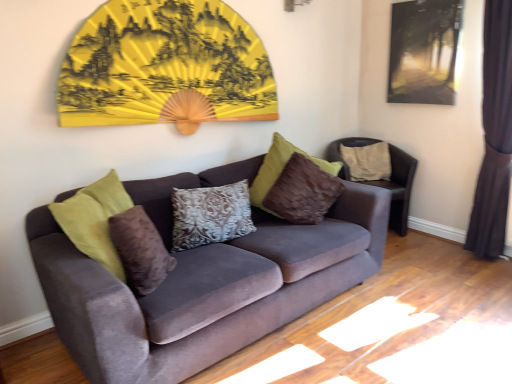
The height and width of the screenshot is (384, 512). Identify the location of beige fabric pillow at right, acting as the third pillow starting from the left. (367, 161).

Identify the location of yellow paper fan at upper center. (165, 67).

Describe the element at coordinates (165, 67) in the screenshot. I see `yellow paper fan at upper center` at that location.

Where is `velvet brown chair at right`? velvet brown chair at right is located at coordinates (398, 188).

Consider the image. Measure the distance between dark brown velvet curtain at right and camera.

The depth of dark brown velvet curtain at right is 8.89 feet.

Image resolution: width=512 pixels, height=384 pixels. I want to click on matte black picture frame at upper right, so click(x=424, y=51).

Identify the location of brown velvet pillow at center, the first pillow when ordered from left to right. This screenshot has height=384, width=512. [140, 250].

What are the coordinates of `beige fabric pillow at right, which is the third pillow from front to back` in the screenshot? It's located at (367, 161).

Choose the correct answer: Is matte black picture frame at upper right inside velvet couch at center or outside it?

matte black picture frame at upper right cannot be found inside velvet couch at center.

Is matte black picture frame at upper right not close to velvet couch at center?

Indeed, matte black picture frame at upper right is not near velvet couch at center.

From a real-world perspective, between matte black picture frame at upper right and velvet couch at center, who is vertically higher?

From a 3D spatial view, matte black picture frame at upper right is above.

Does point (416, 93) appear closer or farther from the camera than point (301, 301)?

Point (416, 93).

Could you tell me if velvet couch at center is turned towards velvet brown chair at right?

No, velvet couch at center does not turn towards velvet brown chair at right.

From the picture: From the image's perspective, is velvet couch at center below velvet brown chair at right?

Indeed, from the image's perspective, velvet couch at center is shown beneath velvet brown chair at right.

From a real-world perspective, is velvet couch at center above or below velvet brown chair at right?

Clearly, from a real-world perspective, velvet couch at center is above velvet brown chair at right.

Is velvet couch at center at the left side of velvet brown chair at right?

Correct, you'll find velvet couch at center to the left of velvet brown chair at right.

Is beige fabric pillow at right, acting as the third pillow starting from the left, oriented towards yellow paper fan at upper center?

No, beige fabric pillow at right, acting as the third pillow starting from the left, is not turned towards yellow paper fan at upper center.

Considering the positions of objects beige fabric pillow at right, arranged as the first pillow when viewed from the back, and yellow paper fan at upper center in the image provided, who is more to the right, beige fabric pillow at right, arranged as the first pillow when viewed from the back, or yellow paper fan at upper center?

From the viewer's perspective, beige fabric pillow at right, arranged as the first pillow when viewed from the back, appears more on the right side.

Looking at the image, does beige fabric pillow at right, arranged as the first pillow when viewed from the back, seem bigger or smaller compared to yellow paper fan at upper center?

Clearly, beige fabric pillow at right, arranged as the first pillow when viewed from the back, is smaller in size than yellow paper fan at upper center.

Could you measure the distance between beige fabric pillow at right, which is the third pillow from front to back, and yellow paper fan at upper center?

1.55 meters.

Considering the sizes of velvet couch at center and yellow paper fan at upper center in the image, is velvet couch at center wider or thinner than yellow paper fan at upper center?

Considering their sizes, velvet couch at center looks broader than yellow paper fan at upper center.

Measure the distance from velvet couch at center to yellow paper fan at upper center.

velvet couch at center and yellow paper fan at upper center are 33.16 inches apart.

Is velvet couch at center facing towards yellow paper fan at upper center?

No, velvet couch at center is not facing towards yellow paper fan at upper center.

Is velvet couch at center with yellow paper fan at upper center?

There is a gap between velvet couch at center and yellow paper fan at upper center.

Is patterned fabric pillow at center, placed as the 2th pillow when sorted from right to left, next to yellow paper fan at upper center and touching it?

No, patterned fabric pillow at center, placed as the 2th pillow when sorted from right to left, is not in contact with yellow paper fan at upper center.

Between patterned fabric pillow at center, positioned as the 2th pillow in back-to-front order, and yellow paper fan at upper center, which one has larger width?

Wider between the two is patterned fabric pillow at center, positioned as the 2th pillow in back-to-front order.

Can you tell me how much patterned fabric pillow at center, positioned as the 2th pillow in back-to-front order, and yellow paper fan at upper center differ in facing direction?

There is a 4-degree angle between the facing directions of patterned fabric pillow at center, positioned as the 2th pillow in back-to-front order, and yellow paper fan at upper center.

Is patterned fabric pillow at center, which is the second pillow from front to back, looking in the opposite direction of yellow paper fan at upper center?

No, patterned fabric pillow at center, which is the second pillow from front to back,'s orientation is not away from yellow paper fan at upper center.

From a real-world perspective, does yellow paper fan at upper center sit lower than brown velvet pillow at center, placed as the 3th pillow when sorted from right to left?

Actually, yellow paper fan at upper center is physically above brown velvet pillow at center, placed as the 3th pillow when sorted from right to left, in the real world.

From the image's perspective, who appears lower, yellow paper fan at upper center or brown velvet pillow at center, placed as the 3th pillow when sorted from right to left?

brown velvet pillow at center, placed as the 3th pillow when sorted from right to left, appears lower in the image.

Looking at this image, is yellow paper fan at upper center outside of brown velvet pillow at center, placed as the 1th pillow when sorted from front to back?

That's correct, yellow paper fan at upper center is outside of brown velvet pillow at center, placed as the 1th pillow when sorted from front to back.

Which is closer to the camera, (341, 178) or (162, 271)?

Clearly, point (341, 178) is more distant from the camera than point (162, 271).

From a real-world perspective, which object stands above the other?

brown velvet pillow at center, positioned as the 3th pillow in back-to-front order, from a real-world perspective.

From the image's perspective, is velvet brown chair at right under brown velvet pillow at center, placed as the 1th pillow when sorted from front to back?

No, from the image's perspective, velvet brown chair at right is not beneath brown velvet pillow at center, placed as the 1th pillow when sorted from front to back.

Considering the relative sizes of velvet brown chair at right and brown velvet pillow at center, the first pillow when ordered from left to right, in the image provided, is velvet brown chair at right wider than brown velvet pillow at center, the first pillow when ordered from left to right,?

Indeed, velvet brown chair at right has a greater width compared to brown velvet pillow at center, the first pillow when ordered from left to right.

Identify the location of studio couch in front of the matte black picture frame at upper right. The image size is (512, 384). (205, 290).

Where is `chair that is on the right side of velvet couch at center`? chair that is on the right side of velvet couch at center is located at coordinates (398, 188).

From the picture: From the image, which object appears to be nearer to beige fabric pillow at right, acting as the third pillow starting from the left, dark brown velvet curtain at right or brown velvet pillow at center, positioned as the 3th pillow in back-to-front order?

dark brown velvet curtain at right lies closer to beige fabric pillow at right, acting as the third pillow starting from the left, than the other object.

Considering their positions, is velvet couch at center positioned closer to yellow paper fan at upper center than velvet brown chair at right?

Based on the image, velvet couch at center appears to be nearer to yellow paper fan at upper center.

In the scene shown: When comparing their distances from matte black picture frame at upper right, does beige fabric pillow at right, acting as the third pillow starting from the left, or velvet couch at center seem further?

The object further to matte black picture frame at upper right is velvet couch at center.

Considering their positions, is velvet brown chair at right positioned further to yellow paper fan at upper center than beige fabric pillow at right, which ranks as the 1th pillow in right-to-left order?

beige fabric pillow at right, which ranks as the 1th pillow in right-to-left order, is positioned further to the anchor yellow paper fan at upper center.

Considering their positions, is yellow paper fan at upper center positioned further to velvet couch at center than dark brown velvet curtain at right?

dark brown velvet curtain at right lies further to velvet couch at center than the other object.

When comparing their distances from velvet couch at center, does beige fabric pillow at right, which is the third pillow from front to back, or velvet brown chair at right seem closer?

Among the two, velvet brown chair at right is located nearer to velvet couch at center.

Based on their spatial positions, is patterned fabric pillow at center, placed as the 2th pillow when sorted from right to left, or yellow paper fan at upper center closer to dark brown velvet curtain at right?

patterned fabric pillow at center, placed as the 2th pillow when sorted from right to left, is positioned closer to the anchor dark brown velvet curtain at right.

Which object lies nearer to the anchor point beige fabric pillow at right, which ranks as the 1th pillow in right-to-left order, brown velvet pillow at center, placed as the 1th pillow when sorted from front to back, or patterned fabric pillow at center, the 2th pillow from the left?

Among the two, patterned fabric pillow at center, the 2th pillow from the left, is located nearer to beige fabric pillow at right, which ranks as the 1th pillow in right-to-left order.

In order to click on chair located between velvet couch at center and dark brown velvet curtain at right in the left-right direction in this screenshot , I will do `click(398, 188)`.

The width and height of the screenshot is (512, 384). I want to click on chair between brown velvet pillow at center, placed as the 3th pillow when sorted from right to left, and dark brown velvet curtain at right, so click(x=398, y=188).

The height and width of the screenshot is (384, 512). In order to click on picture frame between yellow paper fan at upper center and dark brown velvet curtain at right from left to right in this screenshot , I will do `click(424, 51)`.

Identify the location of curtain located between velvet couch at center and beige fabric pillow at right, which is the third pillow from front to back, in the depth direction. (494, 135).